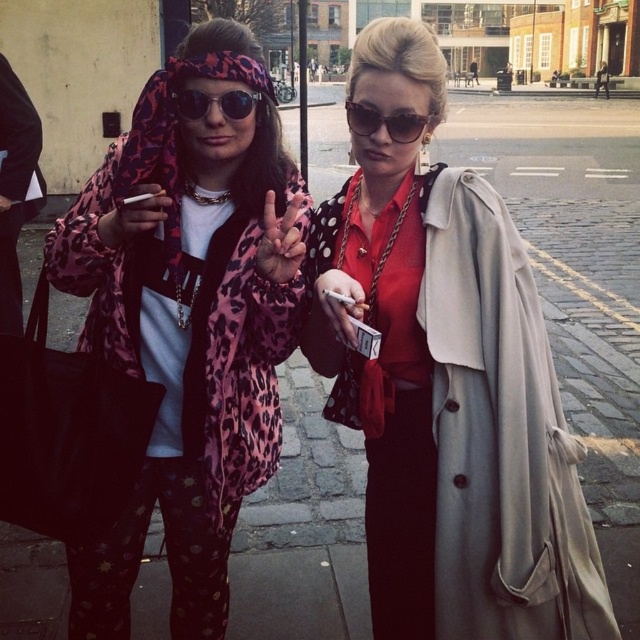
You are a fashion designer trying to place a small accessory between the two trench coats. The accessory is 2.5 inches wide. Can you fit it between the matte beige trench coat at center and the light beige fabric trench coat at center?

The distance between the matte beige trench coat at center and the light beige fabric trench coat at center is 3.09 inches. Since the accessory is 2.5 inches wide, it can fit between them as there is enough space.

You are a photographer trying to capture a closeup shot of the matte black cigarette at center and the sunglasses at upper center. Which object should you zoom in on more to ensure both are in focus?

The matte black cigarette at center is thinner than sunglasses at upper center, so you should zoom in more on the sunglasses at upper center to ensure both are in focus.